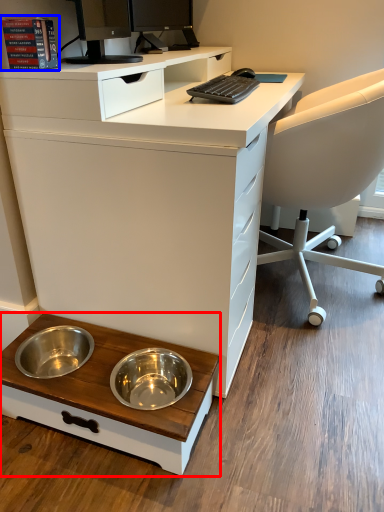
Question: Which object appears closest to the camera in this image, table (highlighted by a red box) or book (highlighted by a blue box)?

Choices:
 (A) table
 (B) book

Answer: (B)